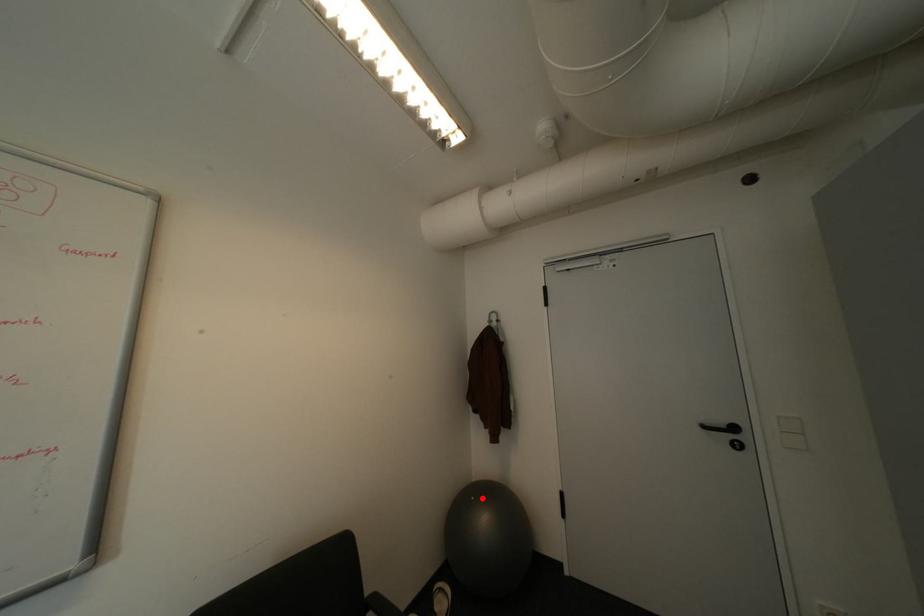
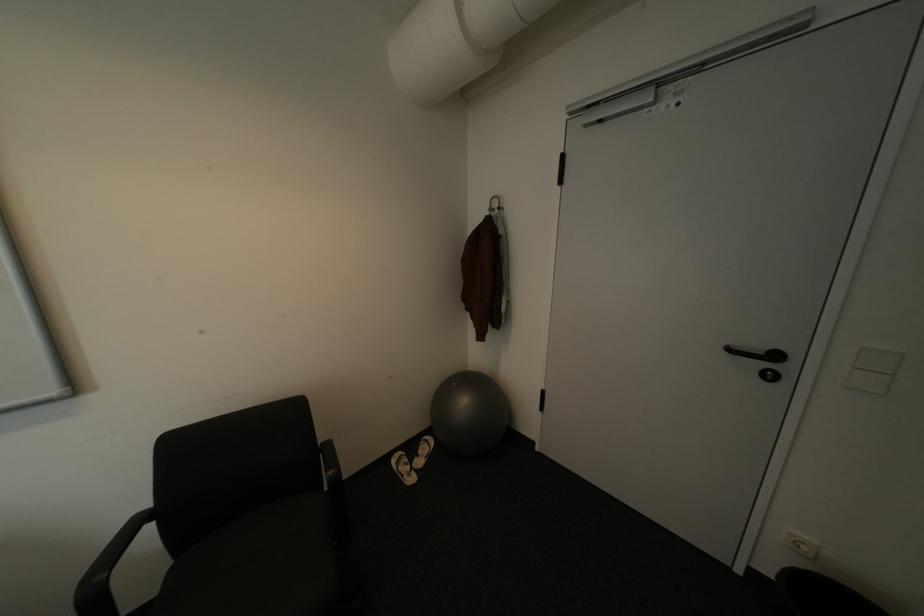
Question: A red point is marked in image1. In image2, is the corresponding 3D point closer to the camera or farther? Reply with the corresponding letter.

Choices:
 (A) The corresponding 3D point is closer.
 (B) The corresponding 3D point is farther.

Answer: (B)